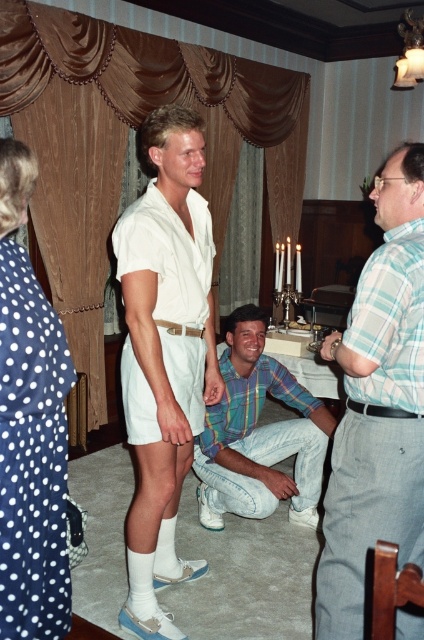
Who is lower down, white matte shorts at center or plaid cotton shirt at center?

plaid cotton shirt at center

Based on the photo, is white matte shorts at center above plaid cotton shirt at center?

Indeed, white matte shorts at center is positioned over plaid cotton shirt at center.

The width and height of the screenshot is (424, 640). I want to click on white matte shorts at center, so click(164, 355).

Where is `white matte shorts at center`? The height and width of the screenshot is (640, 424). white matte shorts at center is located at coordinates (164, 355).

Can you confirm if white matte shorts at center is positioned above plaid shirt at center?

Yes, white matte shorts at center is above plaid shirt at center.

Who is more distant from viewer, (172, 445) or (326, 557)?

Positioned behind is point (172, 445).

Locate an element on the screen. The height and width of the screenshot is (640, 424). white matte shorts at center is located at coordinates (164, 355).

Does white polka dot dress at left have a lesser height compared to plaid cotton shirt at center?

No.

Can you confirm if white polka dot dress at left is bigger than plaid cotton shirt at center?

Incorrect, white polka dot dress at left is not larger than plaid cotton shirt at center.

Is point (7, 220) farther from viewer compared to point (290, 372)?

That is False.

This screenshot has height=640, width=424. What are the coordinates of `white polka dot dress at left` in the screenshot? It's located at (30, 428).